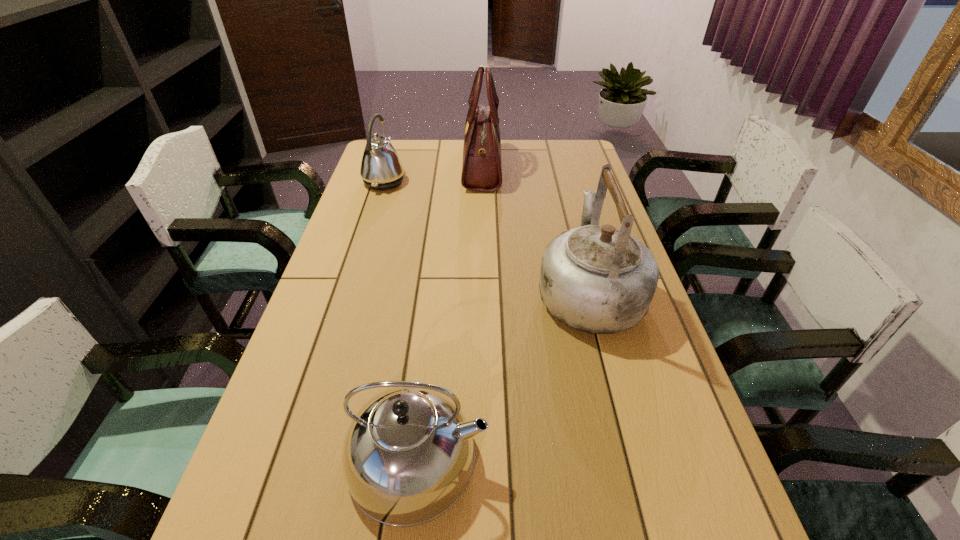
What are the coordinates of `vacant position at the right edge of the desktop` in the screenshot? It's located at (660, 344).

Where is `free spot at the far right corner of the desktop`? The height and width of the screenshot is (540, 960). free spot at the far right corner of the desktop is located at coordinates (552, 145).

At what (x,y) coordinates should I click in order to perform the action: click on free spot between the second nearest kettle and the handbag. Please return your answer as a coordinate pair (x, y). This screenshot has height=540, width=960. Looking at the image, I should click on (536, 229).

This screenshot has width=960, height=540. I want to click on vacant region between the leftmost object and the second kettle from left to right, so click(x=401, y=320).

Image resolution: width=960 pixels, height=540 pixels. I want to click on free space between the farthest kettle and the rightmost object, so click(x=487, y=237).

The height and width of the screenshot is (540, 960). I want to click on vacant space that's between the tallest kettle and the handbag, so click(x=536, y=229).

The image size is (960, 540). I want to click on vacant area that lies between the second kettle from left to right and the handbag, so click(x=450, y=312).

Locate an element on the screen. Image resolution: width=960 pixels, height=540 pixels. free space between the handbag and the farthest kettle is located at coordinates (433, 174).

Identify the location of free space that is in between the handbag and the farthest kettle. The height and width of the screenshot is (540, 960). (433, 174).

The height and width of the screenshot is (540, 960). I want to click on free space between the tallest kettle and the nearest kettle, so [503, 374].